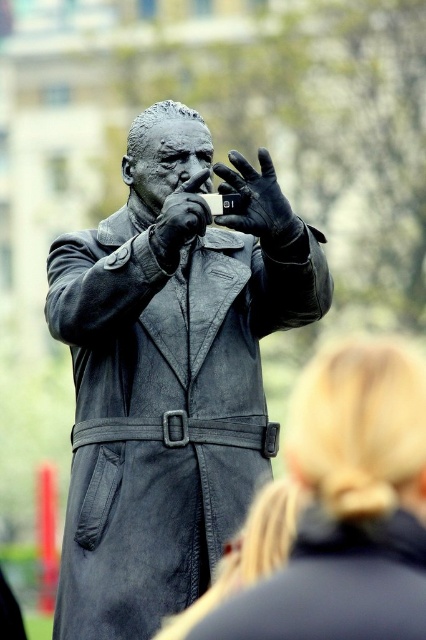
Question: Which point is closer to the camera?

Choices:
 (A) (270, 212)
 (B) (155, 237)

Answer: (B)

Question: Is bronze statue at center to the left of polished bronze hand at center from the viewer's perspective?

Choices:
 (A) yes
 (B) no

Answer: (A)

Question: Which object is farther from the camera taking this photo?

Choices:
 (A) black leather glove at center
 (B) bronze statue at center
 (C) polished bronze hand at center

Answer: (B)

Question: Which of the following is the farthest from the observer?

Choices:
 (A) (290, 211)
 (B) (97, 324)

Answer: (A)

Question: Does black leather glove at center come behind polished bronze hand at center?

Choices:
 (A) yes
 (B) no

Answer: (B)

Question: From the image, what is the correct spatial relationship of bronze statue at center in relation to black leather glove at center?

Choices:
 (A) left
 (B) right

Answer: (A)